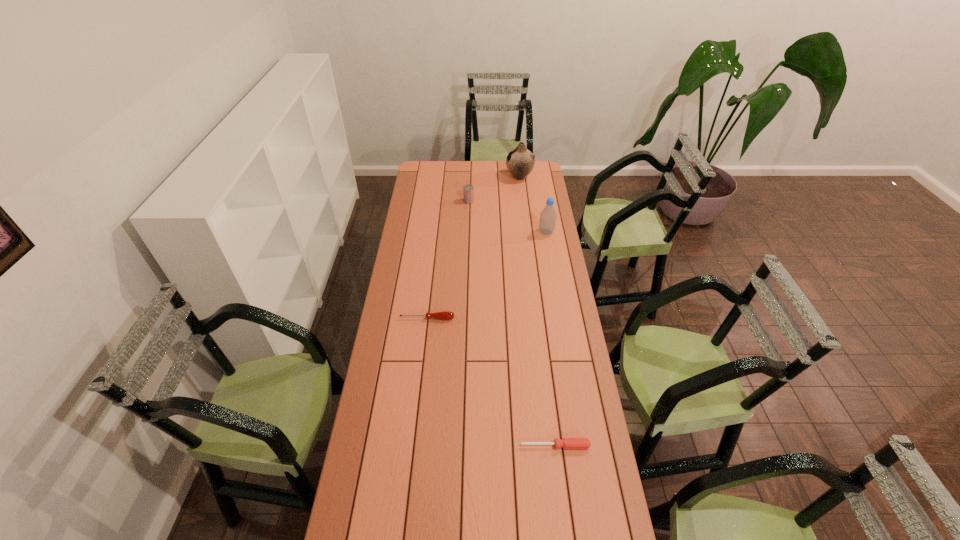
Find the location of `the farthest object`. the farthest object is located at coordinates (520, 161).

At what (x,y) coordinates should I click in order to perform the action: click on bottle. Please return your answer as a coordinate pair (x, y). This screenshot has width=960, height=540. Looking at the image, I should click on (548, 216).

Where is `the fourth object from right to left`? The width and height of the screenshot is (960, 540). the fourth object from right to left is located at coordinates (x=468, y=190).

You are a GUI agent. You are given a task and a screenshot of the screen. Output one action in this format:
    pyautogui.click(x=<x>, y=<y>)
    Task: Click on the third shortest object
    This screenshot has height=540, width=960.
    Given the screenshot: What is the action you would take?
    pyautogui.click(x=468, y=190)

Identify the location of the leftmost object. (444, 315).

You are a GUI agent. You are given a task and a screenshot of the screen. Output one action in this format:
    pyautogui.click(x=<x>, y=<y>)
    Task: Click on the left screwdriver
    This screenshot has width=960, height=540.
    Given the screenshot: What is the action you would take?
    pyautogui.click(x=444, y=315)

Image resolution: width=960 pixels, height=540 pixels. I want to click on the right screwdriver, so click(567, 443).

I want to click on the nearer screwdriver, so click(x=567, y=443).

You are a GUI agent. You are given a task and a screenshot of the screen. Output one action in this format:
    pyautogui.click(x=<x>, y=<y>)
    Task: Click on the blank space located 0.400m from the spout of the pottery
    This screenshot has height=540, width=960.
    Given the screenshot: What is the action you would take?
    pyautogui.click(x=440, y=177)

At what (x,y) coordinates should I click in order to perform the action: click on vacant space situated from the spout of the pottery. Please return your answer as a coordinate pair (x, y). The image size is (960, 540). Looking at the image, I should click on (454, 177).